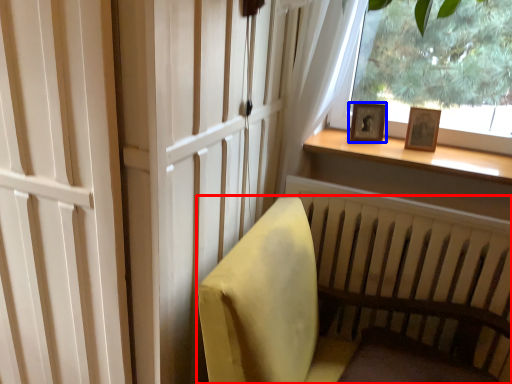
Question: Which of the following is the farthest to the observer, furniture (highlighted by a red box) or picture frame (highlighted by a blue box)?

Choices:
 (A) furniture
 (B) picture frame

Answer: (B)